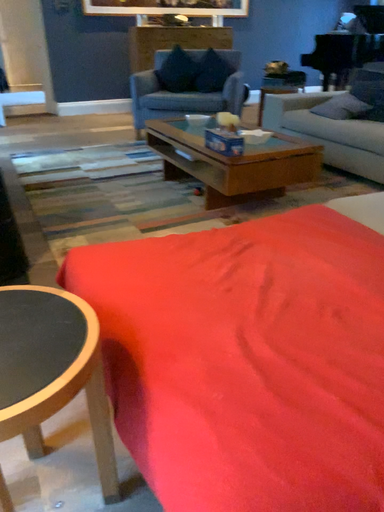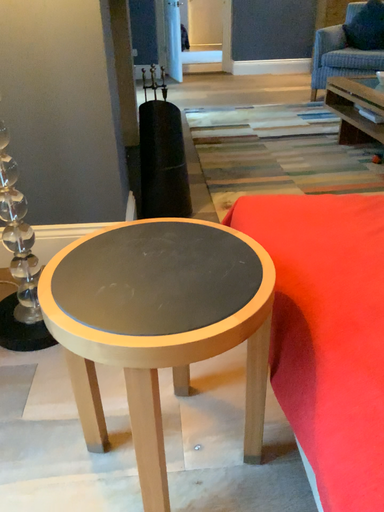
Question: Which way did the camera rotate in the video?

Choices:
 (A) rotated left
 (B) rotated right

Answer: (A)